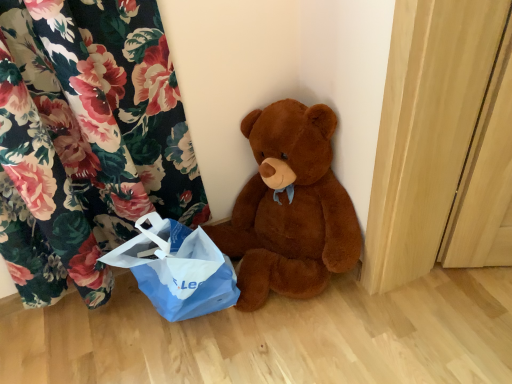
Describe the element at coordinates (289, 208) in the screenshot. I see `brown plush teddy bear at center` at that location.

Based on the photo, measure the distance between brown plush teddy bear at center and camera.

The depth of brown plush teddy bear at center is 1.19 meters.

You are a GUI agent. You are given a task and a screenshot of the screen. Output one action in this format:
    pyautogui.click(x=<x>, y=<y>)
    Task: Click on the brown plush teddy bear at center
    The width and height of the screenshot is (512, 384).
    Given the screenshot: What is the action you would take?
    pyautogui.click(x=289, y=208)

The image size is (512, 384). What do you see at coordinates (177, 268) in the screenshot?
I see `blue paper bag at lower left` at bounding box center [177, 268].

In order to click on blue paper bag at lower left in this screenshot , I will do `click(177, 268)`.

The image size is (512, 384). In order to click on brown plush teddy bear at center in this screenshot , I will do `click(289, 208)`.

Is brown plush teddy bear at center to the left or to the right of blue paper bag at lower left in the image?

Based on their positions, brown plush teddy bear at center is located to the right of blue paper bag at lower left.

Does brown plush teddy bear at center lie behind blue paper bag at lower left?

That is False.

Is point (302, 106) positioned after point (169, 238)?

That is True.

From the image's perspective, which one is positioned lower, brown plush teddy bear at center or blue paper bag at lower left?

blue paper bag at lower left appears lower in the image.

From a real-world perspective, is brown plush teddy bear at center physically below blue paper bag at lower left?

Incorrect, from a real-world perspective, brown plush teddy bear at center is higher than blue paper bag at lower left.

Looking at this image, considering the sizes of objects brown plush teddy bear at center and blue paper bag at lower left in the image provided, who is wider, brown plush teddy bear at center or blue paper bag at lower left?

Wider between the two is brown plush teddy bear at center.

Does brown plush teddy bear at center have a greater height compared to blue paper bag at lower left?

Yes, brown plush teddy bear at center is taller than blue paper bag at lower left.

In terms of size, does brown plush teddy bear at center appear bigger or smaller than blue paper bag at lower left?

In the image, brown plush teddy bear at center appears to be larger than blue paper bag at lower left.

Is brown plush teddy bear at center not within blue paper bag at lower left?

brown plush teddy bear at center lies outside blue paper bag at lower left's area.

Is brown plush teddy bear at center positioned far away from blue paper bag at lower left?

No, brown plush teddy bear at center is not far away from blue paper bag at lower left.

Could you tell me if brown plush teddy bear at center is facing blue paper bag at lower left?

No, brown plush teddy bear at center does not turn towards blue paper bag at lower left.

In the scene shown: Can you tell me how much brown plush teddy bear at center and blue paper bag at lower left differ in facing direction?

1.13e-05 degrees separate the facing orientations of brown plush teddy bear at center and blue paper bag at lower left.

You are a GUI agent. You are given a task and a screenshot of the screen. Output one action in this format:
    pyautogui.click(x=<x>, y=<y>)
    Task: Click on the grocery bag below the brown plush teddy bear at center (from the image's perspective)
    The width and height of the screenshot is (512, 384).
    Given the screenshot: What is the action you would take?
    pyautogui.click(x=177, y=268)

Does blue paper bag at lower left appear on the right side of brown plush teddy bear at center?

No.

Is blue paper bag at lower left positioned before brown plush teddy bear at center?

No, blue paper bag at lower left is further to the viewer.

Is point (205, 250) positioned in front of point (253, 116)?

Yes.

From the image's perspective, which is above, blue paper bag at lower left or brown plush teddy bear at center?

From the image's view, brown plush teddy bear at center is above.

From a real-world perspective, is blue paper bag at lower left physically above brown plush teddy bear at center?

No, from a real-world perspective, blue paper bag at lower left is not above brown plush teddy bear at center.

Between blue paper bag at lower left and brown plush teddy bear at center, which one has larger width?

With larger width is brown plush teddy bear at center.

Considering the relative sizes of blue paper bag at lower left and brown plush teddy bear at center in the image provided, is blue paper bag at lower left taller than brown plush teddy bear at center?

In fact, blue paper bag at lower left may be shorter than brown plush teddy bear at center.

Considering the sizes of objects blue paper bag at lower left and brown plush teddy bear at center in the image provided, who is smaller, blue paper bag at lower left or brown plush teddy bear at center?

blue paper bag at lower left is smaller.

Is blue paper bag at lower left located outside brown plush teddy bear at center?

Yes, blue paper bag at lower left is not within brown plush teddy bear at center.

Are blue paper bag at lower left and brown plush teddy bear at center beside each other?

blue paper bag at lower left is not next to brown plush teddy bear at center, and they're not touching.

Is brown plush teddy bear at center at the back of blue paper bag at lower left?

No, blue paper bag at lower left is not facing the opposite direction of brown plush teddy bear at center.

How distant is blue paper bag at lower left from brown plush teddy bear at center?

blue paper bag at lower left is 9.92 inches from brown plush teddy bear at center.

This screenshot has height=384, width=512. I want to click on teddy bear in front of the blue paper bag at lower left, so click(289, 208).

This screenshot has height=384, width=512. Identify the location of grocery bag lying on the left of brown plush teddy bear at center. (177, 268).

The image size is (512, 384). Identify the location of teddy bear located above the blue paper bag at lower left (from a real-world perspective). (289, 208).